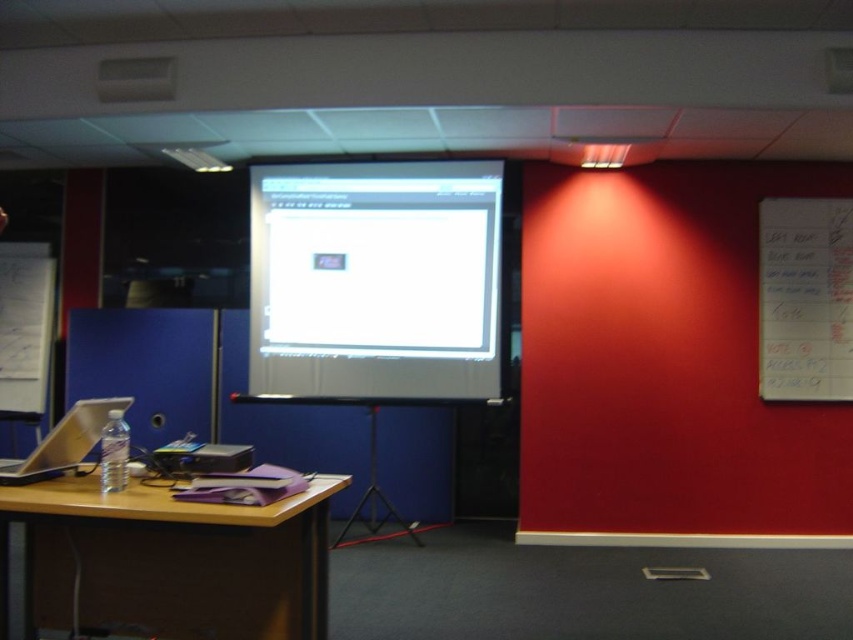
You are standing in the classroom and want to present your slides. You notice a point at coordinates (x=375, y=280). What object is located at that point?

The white glossy projector screen at center is located at point (x=375, y=280).

You are standing in the classroom and want to move from the point at coordinates point [821,305] to the point at coordinates point [77,419]. Which direction should you move?

You should move downward and to the right because point [77,419] is lower and to the right of point [821,305].